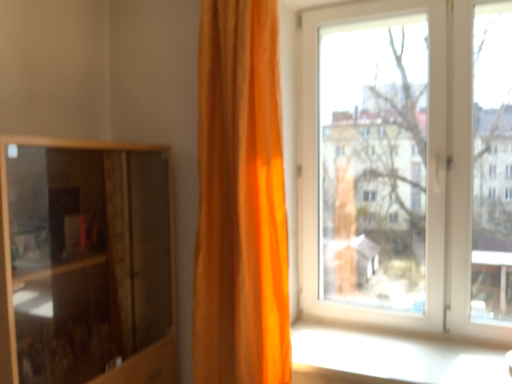
I want to click on wooden cabinet at left, so [85, 262].

In order to click on white glossy window sill at lower right in this screenshot , I will do `click(389, 358)`.

In order to click on wooden cabinet at left in this screenshot , I will do `click(85, 262)`.

Looking at this image, is orange fabric curtain at center completely or partially inside wooden cabinet at left?

Definitely not — orange fabric curtain at center is not inside wooden cabinet at left.

At what (x,y) coordinates should I click in order to perform the action: click on cupboard below the orange fabric curtain at center (from the image's perspective). Please return your answer as a coordinate pair (x, y). Looking at the image, I should click on (85, 262).

Are wooden cabinet at left and orange fabric curtain at center making contact?

They are not placed beside each other.

How far apart are wooden cabinet at left and orange fabric curtain at center?

They are 21.17 inches apart.

Does white glossy window sill at lower right contain white plastic window at upper right?

Actually, white plastic window at upper right is outside white glossy window sill at lower right.

Is white glossy window sill at lower right taller than white plastic window at upper right?

Incorrect, the height of white glossy window sill at lower right is not larger of that of white plastic window at upper right.

Is white glossy window sill at lower right far away from white plastic window at upper right?

No, there isn't a large distance between white glossy window sill at lower right and white plastic window at upper right.

From a real-world perspective, is white plastic window at upper right below wooden cabinet at left?

No, from a real-world perspective, white plastic window at upper right is not under wooden cabinet at left.

From the image's perspective, which one is positioned higher, white plastic window at upper right or wooden cabinet at left?

white plastic window at upper right appears higher in the image.

Which is more distant, (418, 105) or (14, 230)?

The point (418, 105) is behind.

Considering the relative sizes of white plastic window at upper right and wooden cabinet at left in the image provided, is white plastic window at upper right taller than wooden cabinet at left?

Yes.

What's the angular difference between orange fabric curtain at center and white glossy window sill at lower right's facing directions?

They differ by 2.5 degrees in their facing directions.

Visually, is orange fabric curtain at center positioned to the left or to the right of white glossy window sill at lower right?

From the image, it's evident that orange fabric curtain at center is to the left of white glossy window sill at lower right.

Does orange fabric curtain at center have a lesser height compared to white glossy window sill at lower right?

No, orange fabric curtain at center is not shorter than white glossy window sill at lower right.

From a real-world perspective, between orange fabric curtain at center and white glossy window sill at lower right, who is vertically lower?

white glossy window sill at lower right, from a real-world perspective.

Considering the relative sizes of white plastic window at upper right and orange fabric curtain at center in the image provided, is white plastic window at upper right bigger than orange fabric curtain at center?

Yes.

Who is shorter, white plastic window at upper right or orange fabric curtain at center?

white plastic window at upper right.

Image resolution: width=512 pixels, height=384 pixels. In the image, there is a white plastic window at upper right. In order to click on curtain below it (from the image's perspective) in this screenshot , I will do `click(240, 200)`.

Is white plastic window at upper right spatially inside orange fabric curtain at center, or outside of it?

The correct answer is: outside.

Considering the sizes of objects white glossy window sill at lower right and orange fabric curtain at center in the image provided, who is smaller, white glossy window sill at lower right or orange fabric curtain at center?

Smaller between the two is white glossy window sill at lower right.

Is white glossy window sill at lower right taller than orange fabric curtain at center?

No.

Is white glossy window sill at lower right to the right of orange fabric curtain at center from the viewer's perspective?

Indeed, white glossy window sill at lower right is positioned on the right side of orange fabric curtain at center.

Could you tell me if white glossy window sill at lower right is facing orange fabric curtain at center?

No, white glossy window sill at lower right is not oriented towards orange fabric curtain at center.

Is wooden cabinet at left not near white glossy window sill at lower right?

wooden cabinet at left is actually quite close to white glossy window sill at lower right.

Is wooden cabinet at left thinner than white glossy window sill at lower right?

Yes.

How different are the orientations of wooden cabinet at left and white glossy window sill at lower right in degrees?

The angular difference between wooden cabinet at left and white glossy window sill at lower right is 90.1 degrees.

This screenshot has height=384, width=512. I want to click on cupboard below the orange fabric curtain at center (from a real-world perspective), so click(85, 262).

I want to click on window on the right of white glossy window sill at lower right, so [408, 165].

When comparing their distances from white glossy window sill at lower right, does wooden cabinet at left or white plastic window at upper right seem closer?

white plastic window at upper right lies closer to white glossy window sill at lower right than the other object.

Based on their spatial positions, is white plastic window at upper right or white glossy window sill at lower right further from orange fabric curtain at center?

white plastic window at upper right.

Based on the photo, which object lies nearer to the anchor point white plastic window at upper right, orange fabric curtain at center or white glossy window sill at lower right?

white glossy window sill at lower right.

Estimate the real-world distances between objects in this image. Which object is further from white plastic window at upper right, white glossy window sill at lower right or wooden cabinet at left?

wooden cabinet at left is further to white plastic window at upper right.

Considering their positions, is white glossy window sill at lower right positioned further to wooden cabinet at left than white plastic window at upper right?

white plastic window at upper right is positioned further to the anchor wooden cabinet at left.

From the image, which object appears to be nearer to orange fabric curtain at center, white glossy window sill at lower right or white plastic window at upper right?

The object closer to orange fabric curtain at center is white glossy window sill at lower right.

When comparing their distances from white glossy window sill at lower right, does white plastic window at upper right or wooden cabinet at left seem further?

The object further to white glossy window sill at lower right is wooden cabinet at left.

Based on their spatial positions, is orange fabric curtain at center or white plastic window at upper right closer to white glossy window sill at lower right?

A: Among the two, orange fabric curtain at center is located nearer to white glossy window sill at lower right.

Locate an element on the screen. Image resolution: width=512 pixels, height=384 pixels. curtain between wooden cabinet at left and white glossy window sill at lower right is located at coordinates (240, 200).

In order to click on curtain between white plastic window at upper right and white glossy window sill at lower right vertically in this screenshot , I will do `click(240, 200)`.

Locate an element on the screen. The image size is (512, 384). window sill located between wooden cabinet at left and white plastic window at upper right in the left-right direction is located at coordinates (389, 358).

At what (x,y) coordinates should I click in order to perform the action: click on curtain between wooden cabinet at left and white plastic window at upper right. Please return your answer as a coordinate pair (x, y). This screenshot has width=512, height=384. Looking at the image, I should click on (240, 200).